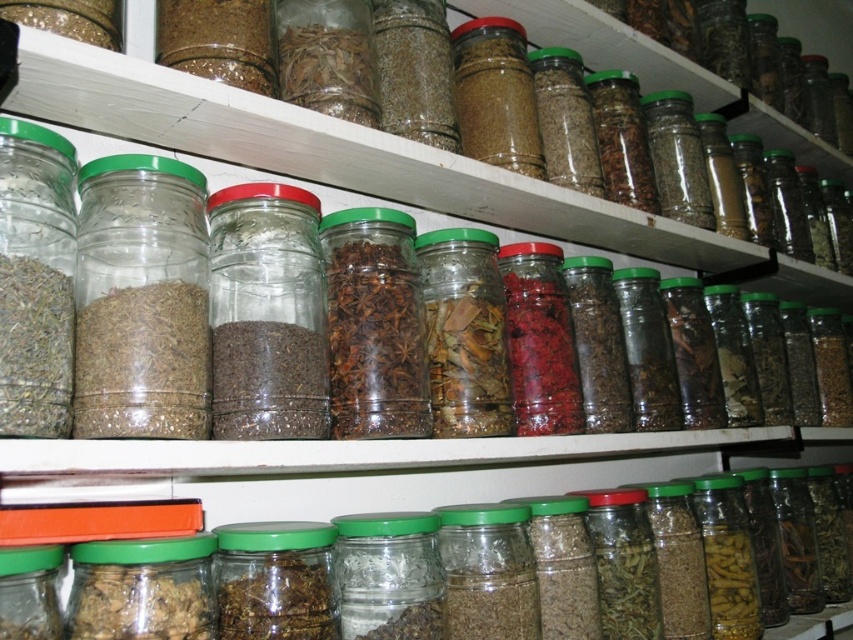
You are organizing a spice rack and need to place the clear glass jars at center and the brown matte jar at center. If you want to place the taller jar on the top shelf for visibility, which one should you choose?

The brown matte jar at center is taller than the clear glass jars at center, so you should place the brown matte jar at center on the top shelf for visibility.

You are a chef preparing to organize your spice rack. You have a new spice jar that is 12 inches wide. Can you place it between the translucent glass jar at left and the green matte glass jar at center?

The distance between the translucent glass jar at left and the green matte glass jar at center is 11.78 inches, which is slightly less than the 12 inch width of the new spice jar. Therefore, the jar will not fit in the space between them.

You are organizing a spice rack and need to place the clear glass jars at center and the brown matte jar at center. According to the image, which jar is placed above the other?

The clear glass jars at center is positioned over brown matte jar at center, so the clear glass jars at center is placed above the brown matte jar at center.